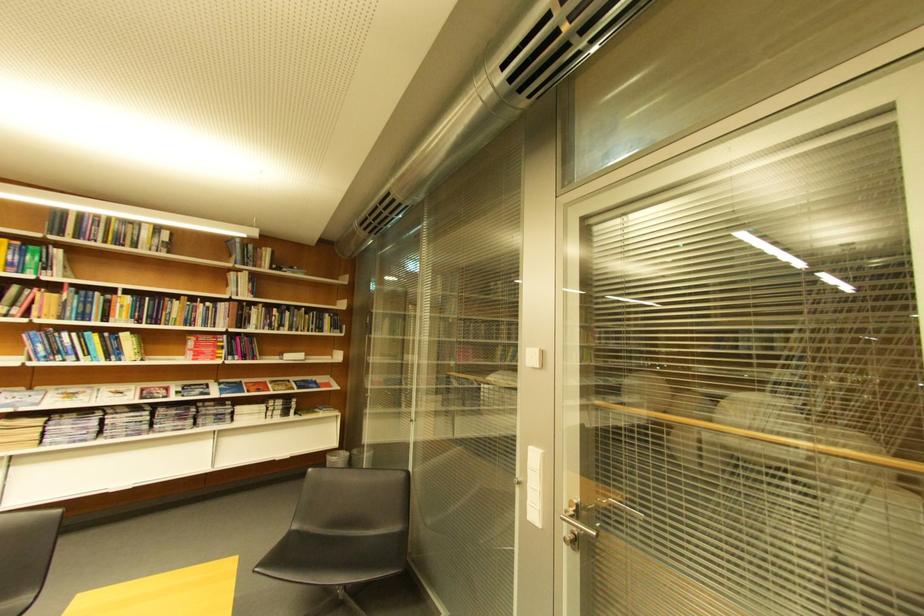
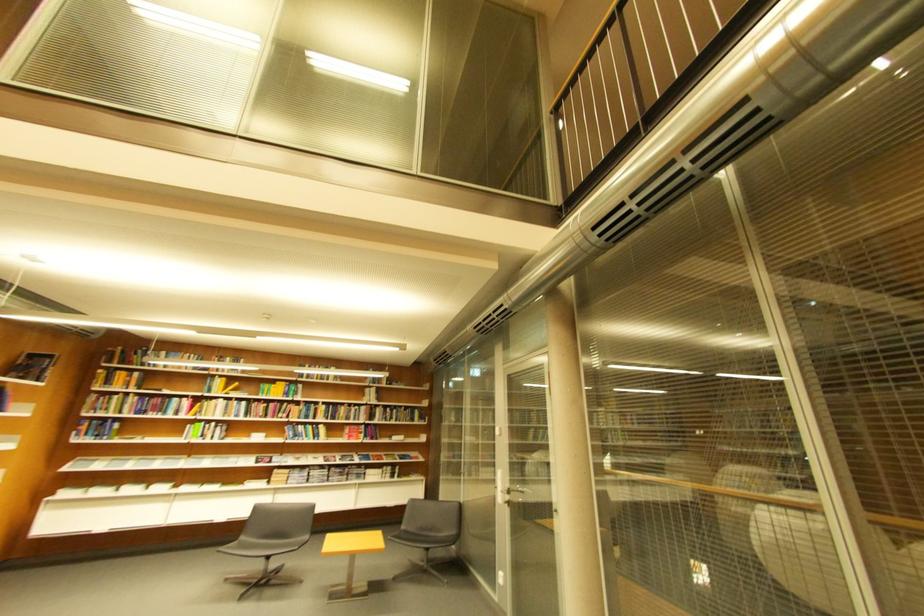
Which direction would the cameraman need to move to produce the second image?

The cameraman moved toward right, backward.